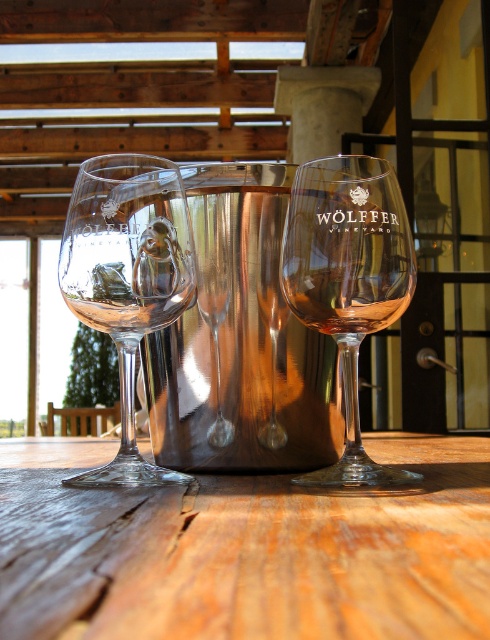
Question: Which object is closer to the camera taking this photo?

Choices:
 (A) wooden table at center
 (B) transparent glass at center
 (C) clear glass wine at center
 (D) clear glass wine glass at left

Answer: (A)

Question: Which object appears farthest from the camera in this image?

Choices:
 (A) transparent glass at center
 (B) clear glass wine at left
 (C) clear glass wine glass at left
 (D) clear glass wine at center

Answer: (B)

Question: Can you confirm if wooden table at center is positioned to the left of clear glass wine at left?

Choices:
 (A) no
 (B) yes

Answer: (A)

Question: Based on their relative distances, which object is farther from the transparent glass at center?

Choices:
 (A) wooden table at center
 (B) clear glass wine glass at left

Answer: (A)

Question: Can you confirm if wooden table at center is positioned above clear glass wine at center?

Choices:
 (A) no
 (B) yes

Answer: (A)

Question: Does wooden table at center appear on the right side of clear glass wine at left?

Choices:
 (A) no
 (B) yes

Answer: (B)